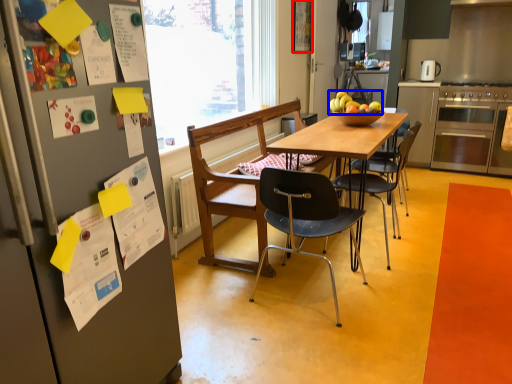
Question: Which object is closer to the camera taking this photo, poster (highlighted by a red box) or fruit (highlighted by a blue box)?

Choices:
 (A) poster
 (B) fruit

Answer: (B)